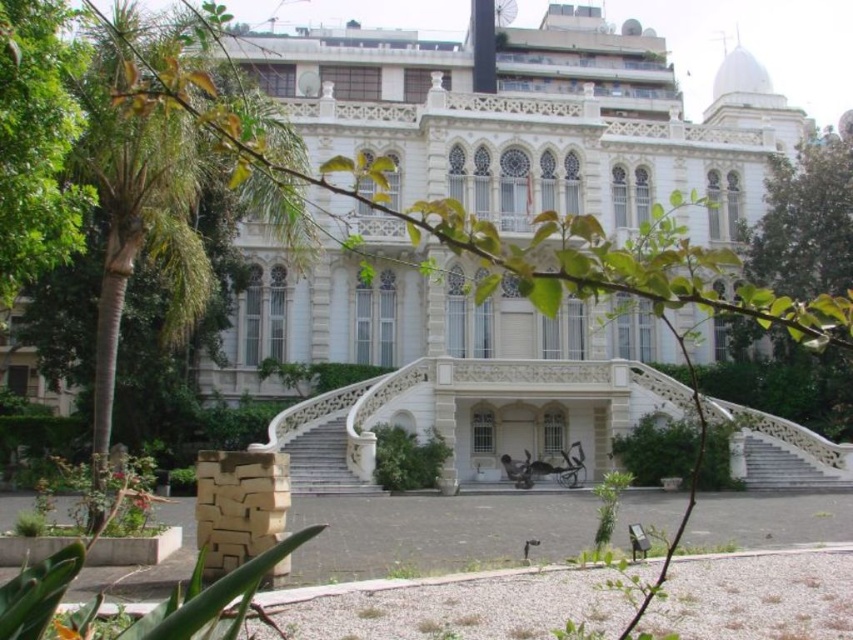
Question: Can you confirm if green leafy tree at left is thinner than white stone staircase at center?

Choices:
 (A) no
 (B) yes

Answer: (A)

Question: Among these objects, which one is nearest to the camera?

Choices:
 (A) white marble staircase at center
 (B) green leafy tree at upper right

Answer: (A)

Question: Considering the relative positions of white marble staircase at center and wooden park bench at center in the image provided, where is white marble staircase at center located with respect to wooden park bench at center?

Choices:
 (A) left
 (B) right

Answer: (A)

Question: Can you confirm if white stone staircase at center is smaller than wooden park bench at center?

Choices:
 (A) yes
 (B) no

Answer: (A)

Question: Which point is farther to the camera?

Choices:
 (A) white marble staircase at center
 (B) wooden park bench at center
 (C) green leafy tree at left
 (D) green leafy tree at upper right

Answer: (D)

Question: Which object is farther from the camera taking this photo?

Choices:
 (A) white stone staircase at center
 (B) green leafy tree at upper right
 (C) wooden park bench at center
 (D) green leafy tree at left

Answer: (B)